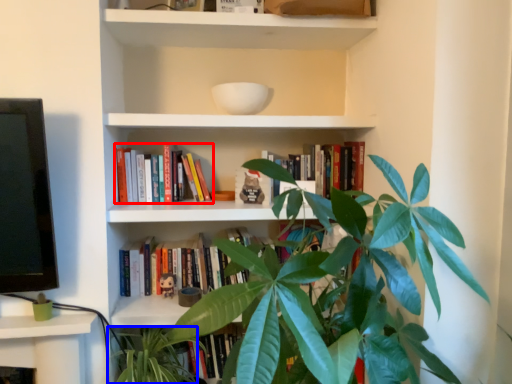
Question: Among these objects, which one is farthest to the camera, book (highlighted by a red box) or vegetation (highlighted by a blue box)?

Choices:
 (A) book
 (B) vegetation

Answer: (A)